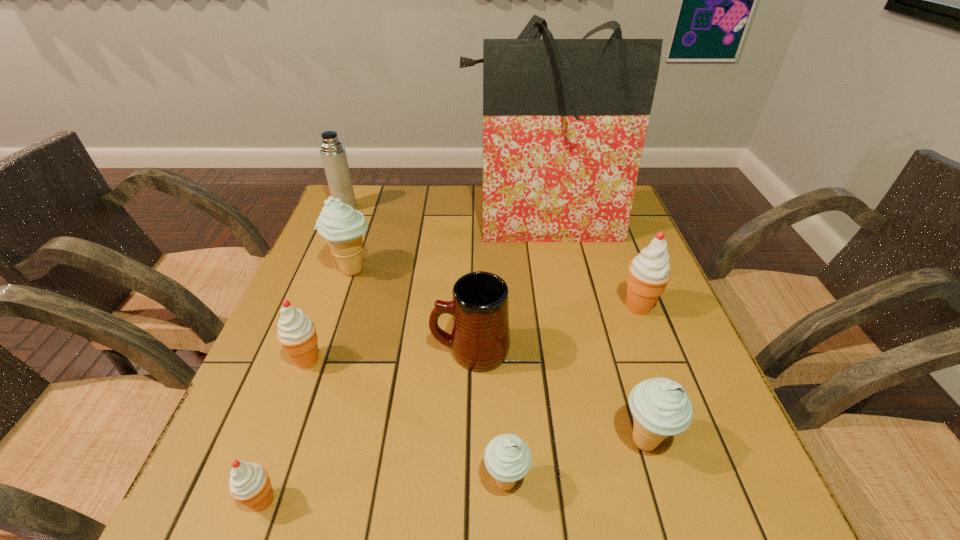
You are a GUI agent. You are given a task and a screenshot of the screen. Output one action in this format:
    pyautogui.click(x=<x>, y=<y>)
    Task: Click on the closest red icecream relative to the rightmost beige icecream
    This screenshot has height=540, width=960.
    Given the screenshot: What is the action you would take?
    pyautogui.click(x=649, y=272)

What are the coordinates of `red icecream that is the second nearest to the second biggest red icecream` in the screenshot? It's located at (649, 272).

What are the coordinates of `vacant space that satisfies the following two spatial constraints: 1. on the front side of the black shopping bag; 2. on the left side of the second smallest beige icecream` in the screenshot? It's located at (581, 442).

Locate an element on the screen. The height and width of the screenshot is (540, 960). vacant region that satisfies the following two spatial constraints: 1. on the side of the red mug with the handle; 2. on the front side of the smallest red icecream is located at coordinates (468, 501).

At what (x,y) coordinates should I click in order to perform the action: click on vacant space that satisfies the following two spatial constraints: 1. on the side of the smallest beige icecream with the handle; 2. on the left side of the mug. Please return your answer as a coordinate pair (x, y). The image size is (960, 540). Looking at the image, I should click on (468, 482).

The height and width of the screenshot is (540, 960). What are the coordinates of `free space that satisfies the following two spatial constraints: 1. on the front side of the rightmost beige icecream; 2. on the right side of the black shopping bag` in the screenshot? It's located at (581, 442).